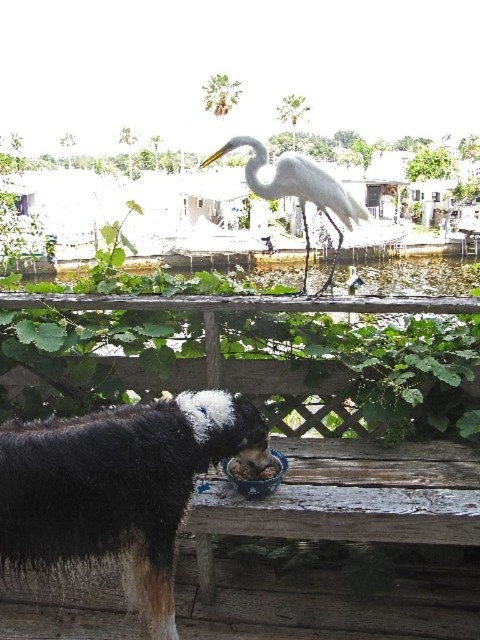
Which is in front, point (108, 461) or point (238, 472)?

Point (108, 461) is more forward.

Can you confirm if black fur dog at center is positioned to the left of brown matte bowl at lower center?

Correct, you'll find black fur dog at center to the left of brown matte bowl at lower center.

Is point (81, 545) positioned behind point (252, 472)?

That is False.

Image resolution: width=480 pixels, height=640 pixels. I want to click on black fur dog at center, so click(118, 488).

Does black fur dog at center appear under white matte bird at center?

Yes.

Can you confirm if black fur dog at center is shorter than white matte bird at center?

Yes, black fur dog at center is shorter than white matte bird at center.

Is point (169, 593) farther from camera compared to point (299, 160)?

No, (169, 593) is closer to viewer.

Find the location of a particular element. black fur dog at center is located at coordinates (118, 488).

Does white matte bird at center appear under brown matte bowl at lower center?

Incorrect, white matte bird at center is not positioned below brown matte bowl at lower center.

Is white matte bird at center positioned behind brown matte bowl at lower center?

Yes, it is behind brown matte bowl at lower center.

Who is more distant from viewer, (242, 144) or (239, 472)?

The point (242, 144) is behind.

The image size is (480, 640). Identify the location of white matte bird at center. (298, 189).